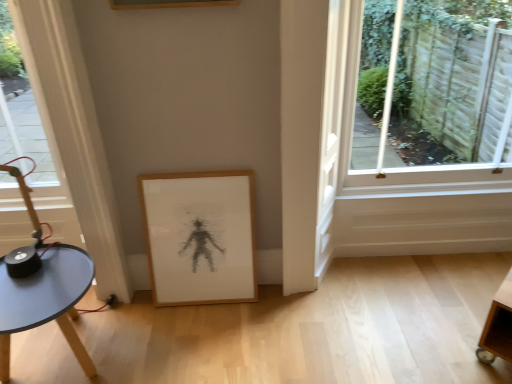
Question: Should I look upward or downward to see matte blue table at lower left?

Choices:
 (A) up
 (B) down

Answer: (B)

Question: Does wooden picture frame at lower center appear on the right side of matte blue table at lower left?

Choices:
 (A) no
 (B) yes

Answer: (B)

Question: Can you confirm if wooden picture frame at lower center is taller than matte blue table at lower left?

Choices:
 (A) no
 (B) yes

Answer: (B)

Question: Can you confirm if wooden picture frame at lower center is positioned to the left of matte blue table at lower left?

Choices:
 (A) no
 (B) yes

Answer: (A)

Question: Can you confirm if wooden picture frame at lower center is bigger than matte blue table at lower left?

Choices:
 (A) yes
 (B) no

Answer: (B)

Question: Does wooden picture frame at lower center have a smaller size compared to matte blue table at lower left?

Choices:
 (A) no
 (B) yes

Answer: (B)

Question: Is wooden picture frame at lower center positioned behind matte blue table at lower left?

Choices:
 (A) yes
 (B) no

Answer: (A)

Question: Does matte blue table at lower left appear on the right side of wooden picture frame at lower center?

Choices:
 (A) no
 (B) yes

Answer: (A)

Question: Considering the relative sizes of matte blue table at lower left and wooden picture frame at lower center in the image provided, is matte blue table at lower left thinner than wooden picture frame at lower center?

Choices:
 (A) yes
 (B) no

Answer: (B)

Question: Is matte blue table at lower left not inside wooden picture frame at lower center?

Choices:
 (A) yes
 (B) no

Answer: (A)

Question: Could wooden picture frame at lower center be considered to be inside matte blue table at lower left?

Choices:
 (A) no
 (B) yes

Answer: (A)

Question: Considering the relative sizes of matte blue table at lower left and wooden picture frame at lower center in the image provided, is matte blue table at lower left shorter than wooden picture frame at lower center?

Choices:
 (A) no
 (B) yes

Answer: (B)

Question: From a real-world perspective, is matte blue table at lower left physically below wooden picture frame at lower center?

Choices:
 (A) no
 (B) yes

Answer: (B)

Question: Considering the relative sizes of clear glass window at upper right and matte blue table at lower left in the image provided, is clear glass window at upper right wider than matte blue table at lower left?

Choices:
 (A) no
 (B) yes

Answer: (A)